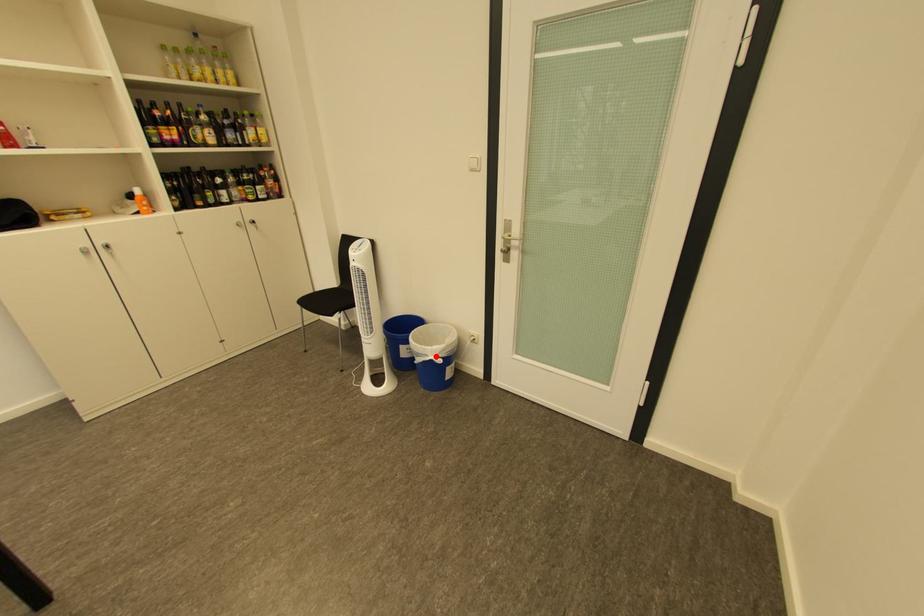
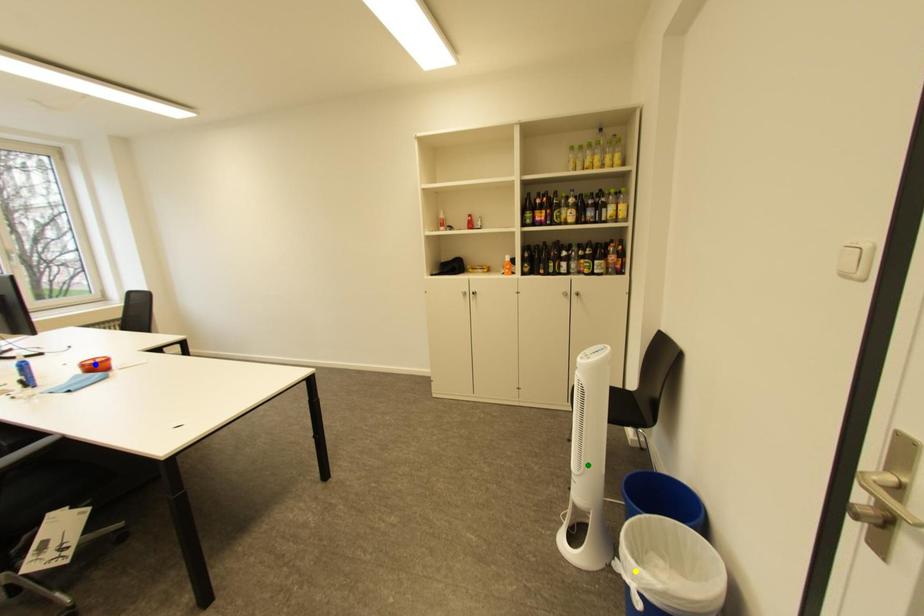
Question: I am providing you with two images of the same scene from different viewpoints. A red point is marked on the first image. You are given multiple points on the second image. Which point in image 2 is actually the same real-world point as the red point in image 1?

Choices:
 (A) blue point
 (B) green point
 (C) yellow point

Answer: (C)